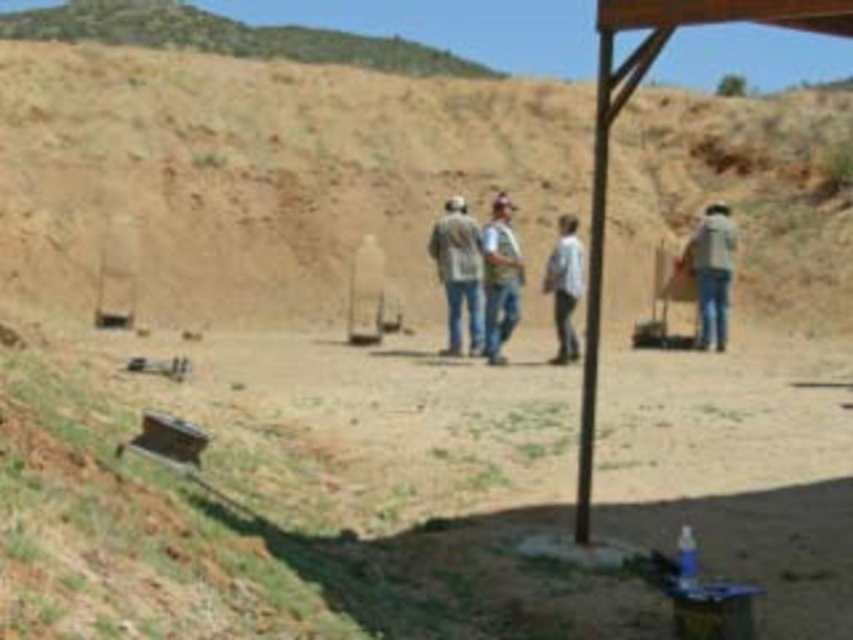
What are the coordinates of the dull brown dirt at center?

The coordinates of the dull brown dirt at center are at point (292,496).

You are standing at the shooting range and see the point at coordinates (292, 496). What surface is this point located on?

The point at coordinates (292, 496) is located on dull brown dirt at center.